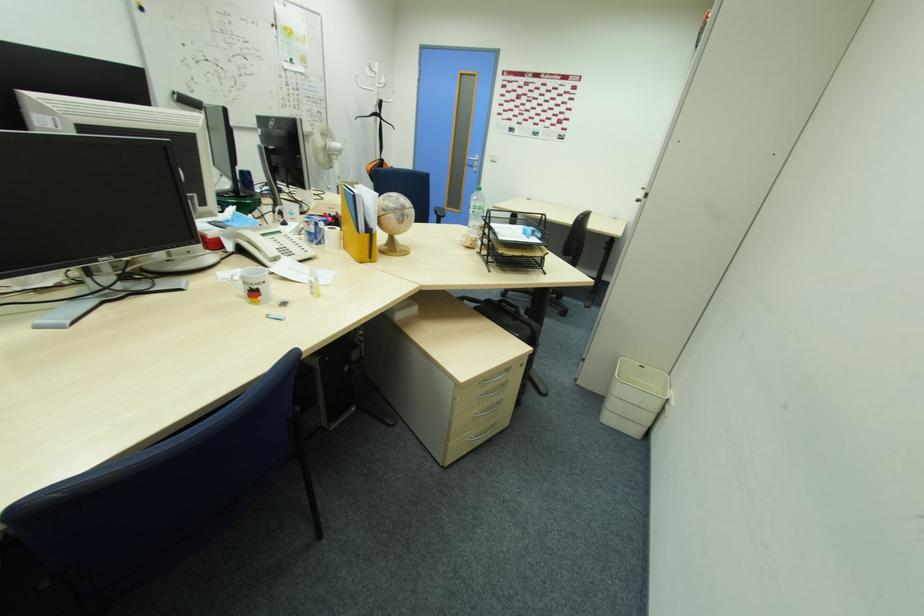
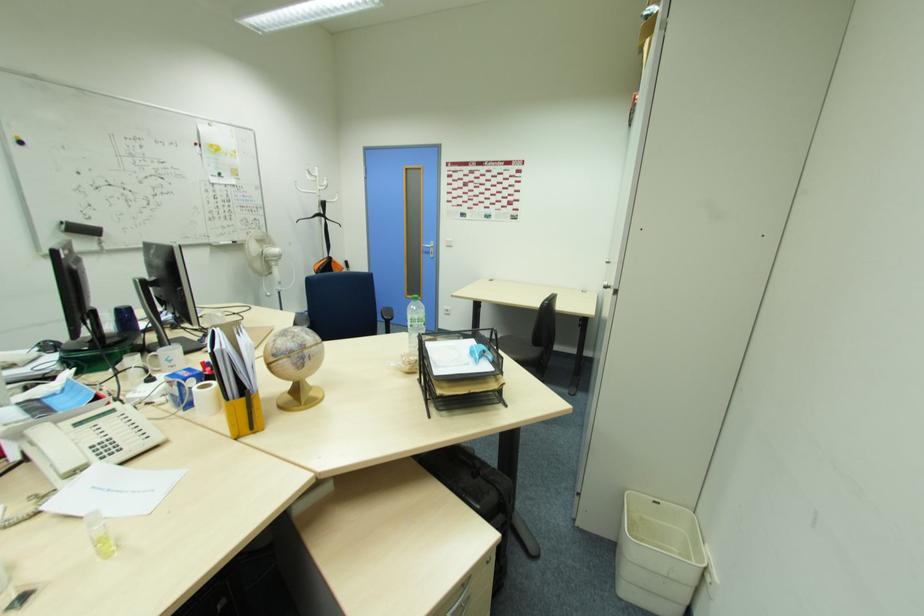
The point at (481, 209) is marked in the first image. Where is the corresponding point in the second image?

(419, 322)